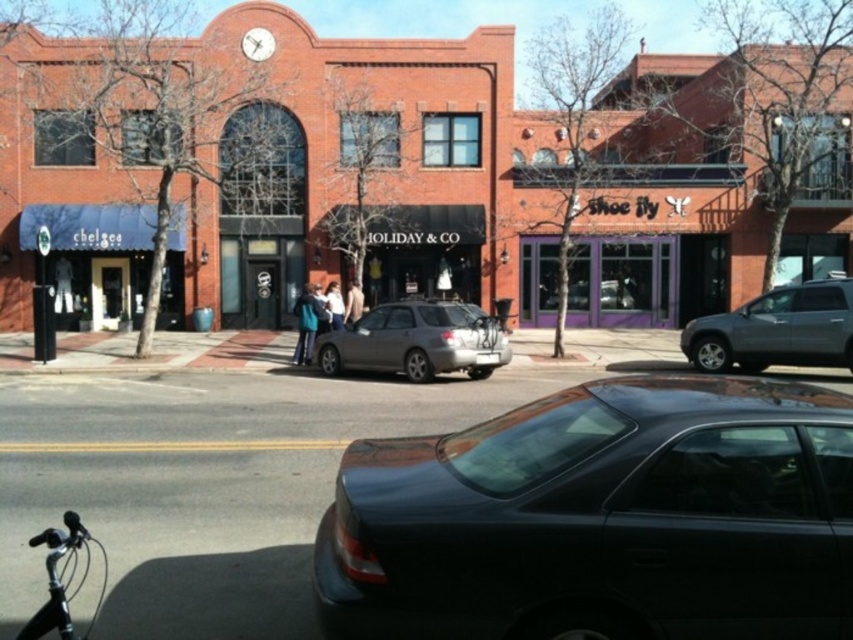
Question: Which object is closer to the camera taking this photo?

Choices:
 (A) silver metallic suv at right
 (B) satin silver sedan at center

Answer: (B)

Question: Which object appears farthest from the camera in this image?

Choices:
 (A) shiny black sedan at center
 (B) shiny silver handlebars at lower left
 (C) satin silver sedan at center
 (D) silver metallic suv at right

Answer: (D)

Question: Which of the following is the closest to the observer?

Choices:
 (A) shiny black sedan at center
 (B) shiny silver handlebars at lower left

Answer: (A)

Question: Does shiny black sedan at center have a lesser width compared to satin silver sedan at center?

Choices:
 (A) no
 (B) yes

Answer: (B)

Question: Where is silver metallic suv at right located in relation to satin silver sedan at center in the image?

Choices:
 (A) below
 (B) above

Answer: (A)

Question: Is shiny black sedan at center above satin silver sedan at center?

Choices:
 (A) yes
 (B) no

Answer: (B)